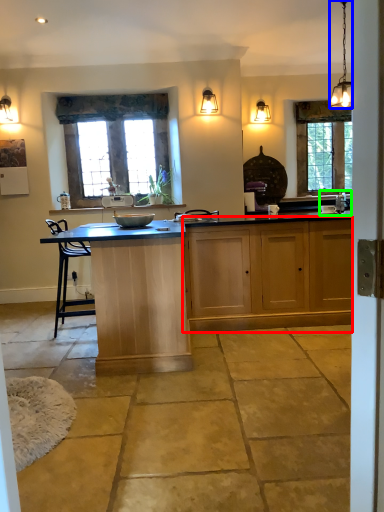
Question: Which object is positioned farthest from cabinetry (highlighted by a red box)? Select from light fixture (highlighted by a blue box) and sink (highlighted by a green box).

Choices:
 (A) light fixture
 (B) sink

Answer: (A)